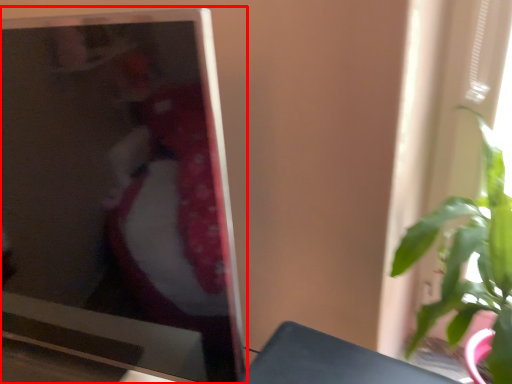
Question: Observing the image, what is the correct spatial positioning of television (annotated by the red box) in reference to houseplant?

Choices:
 (A) right
 (B) left

Answer: (B)